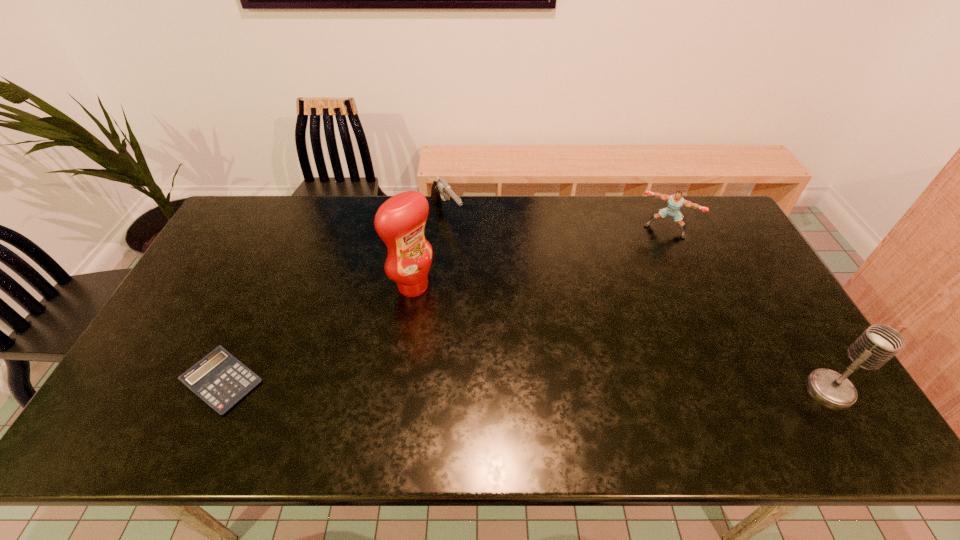
Find the location of a particular element. vacant area at the near edge of the desktop is located at coordinates (563, 393).

At what (x,y) coordinates should I click in order to perform the action: click on free space at the left edge. Please return your answer as a coordinate pair (x, y). The width and height of the screenshot is (960, 540). Looking at the image, I should click on (244, 240).

The height and width of the screenshot is (540, 960). I want to click on vacant area at the far left corner of the desktop, so click(x=271, y=218).

Locate an element on the screen. free space between the rightmost object and the puncher is located at coordinates (748, 309).

This screenshot has height=540, width=960. In order to click on free space between the fourth shortest object and the calculator in this screenshot , I will do `click(527, 385)`.

Find the location of `empty location between the second object from right to left and the fourth shortest object`. empty location between the second object from right to left and the fourth shortest object is located at coordinates (748, 309).

This screenshot has width=960, height=540. I want to click on free space between the second tallest object and the leftmost object, so click(527, 385).

At what (x,y) coordinates should I click in order to perform the action: click on vacant point located between the calculator and the puncher. Please return your answer as a coordinate pair (x, y). Image resolution: width=960 pixels, height=540 pixels. Looking at the image, I should click on pyautogui.click(x=444, y=306).

Locate an element on the screen. This screenshot has width=960, height=540. blank region between the second object from right to left and the rightmost object is located at coordinates [748, 309].

Where is `free space between the second object from right to left and the rightmost object`? The width and height of the screenshot is (960, 540). free space between the second object from right to left and the rightmost object is located at coordinates (748, 309).